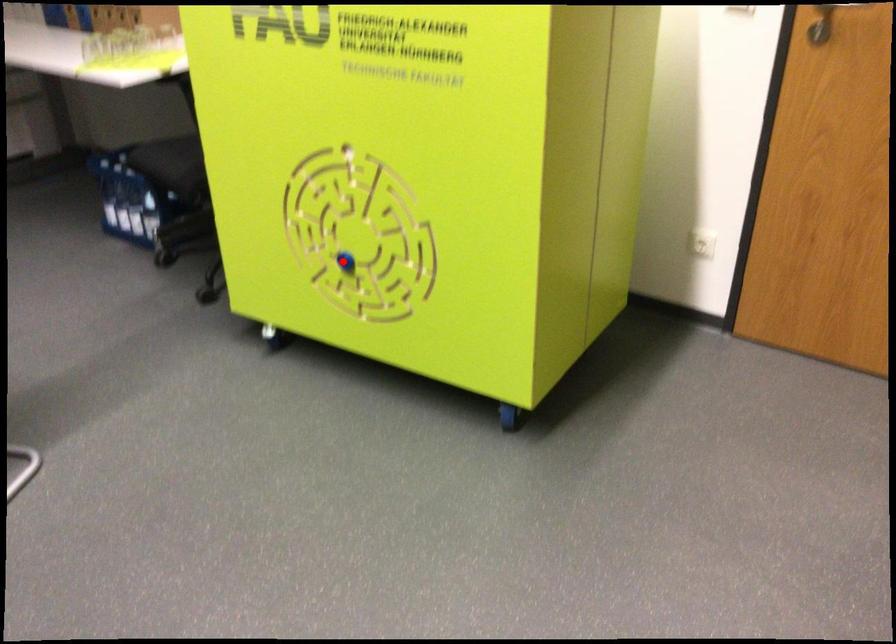
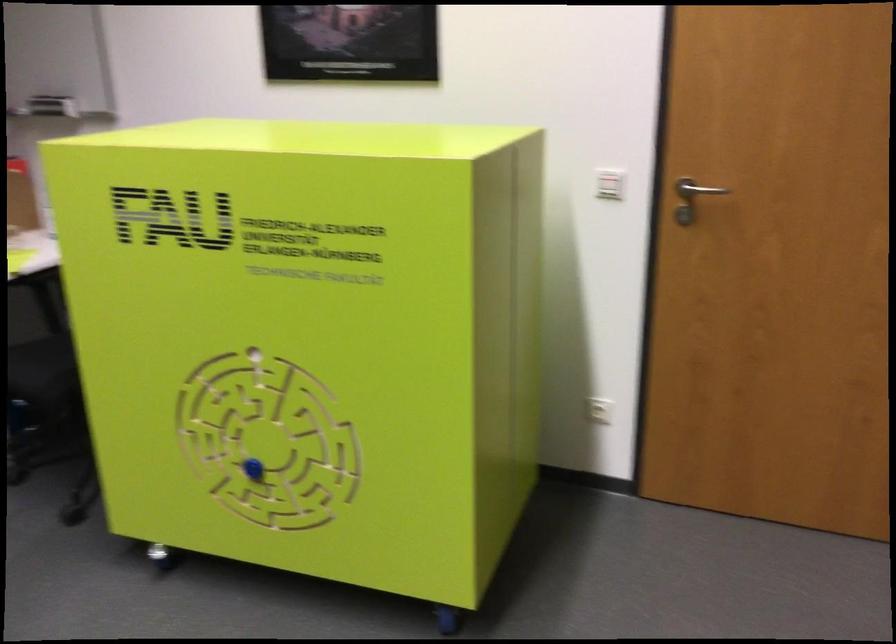
In the second image, find the point that corresponds to the highlighted location in the first image.

(253, 469)